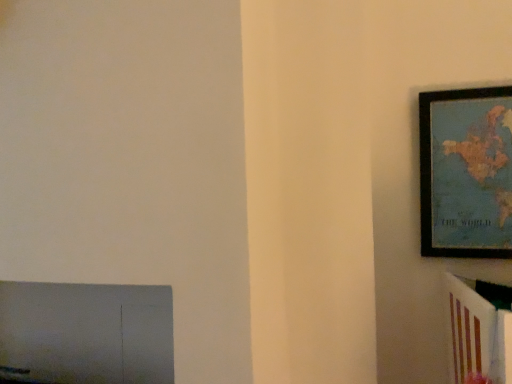
Where is `white glossy bookshelf at right`? white glossy bookshelf at right is located at coordinates (478, 330).

What do you see at coordinates (478, 330) in the screenshot? I see `white glossy bookshelf at right` at bounding box center [478, 330].

Measure the distance between white glossy bookshelf at right and camera.

white glossy bookshelf at right is 34.86 inches away from camera.

Find the location of a particular element. The width and height of the screenshot is (512, 384). wooden framed map at upper right is located at coordinates (466, 173).

The height and width of the screenshot is (384, 512). What do you see at coordinates (466, 173) in the screenshot? I see `wooden framed map at upper right` at bounding box center [466, 173].

Where is `white glossy bookshelf at right`? white glossy bookshelf at right is located at coordinates (478, 330).

Based on their positions, is wooden framed map at upper right located to the left or right of white glossy bookshelf at right?

Based on their positions, wooden framed map at upper right is located to the right of white glossy bookshelf at right.

From the picture: Considering their positions, is wooden framed map at upper right located in front of or behind white glossy bookshelf at right?

Clearly, wooden framed map at upper right is behind white glossy bookshelf at right.

Is point (497, 174) less distant than point (490, 373)?

No, it is behind (490, 373).

From the image's perspective, is wooden framed map at upper right under white glossy bookshelf at right?

No, from the image's perspective, wooden framed map at upper right is not beneath white glossy bookshelf at right.

From a real-world perspective, does wooden framed map at upper right sit lower than white glossy bookshelf at right?

Actually, wooden framed map at upper right is physically above white glossy bookshelf at right in the real world.

Is wooden framed map at upper right wider or thinner than white glossy bookshelf at right?

In the image, wooden framed map at upper right appears to be more narrow than white glossy bookshelf at right.

Can you confirm if wooden framed map at upper right is shorter than white glossy bookshelf at right?

No, wooden framed map at upper right is not shorter than white glossy bookshelf at right.

Is wooden framed map at upper right smaller than white glossy bookshelf at right?

Incorrect, wooden framed map at upper right is not smaller in size than white glossy bookshelf at right.

Is wooden framed map at upper right not inside white glossy bookshelf at right?

Absolutely, wooden framed map at upper right is external to white glossy bookshelf at right.

Is wooden framed map at upper right directly adjacent to white glossy bookshelf at right?

No, wooden framed map at upper right is not making contact with white glossy bookshelf at right.

Does wooden framed map at upper right turn towards white glossy bookshelf at right?

Yes, wooden framed map at upper right is facing white glossy bookshelf at right.

What's the angular difference between wooden framed map at upper right and white glossy bookshelf at right's facing directions?

0.000992 degrees.

In order to click on picture frame above the white glossy bookshelf at right (from the image's perspective) in this screenshot , I will do `click(466, 173)`.

Is white glossy bookshelf at right to the left of wooden framed map at upper right from the viewer's perspective?

Indeed, white glossy bookshelf at right is positioned on the left side of wooden framed map at upper right.

Is white glossy bookshelf at right in front of or behind wooden framed map at upper right in the image?

white glossy bookshelf at right is in front of wooden framed map at upper right.

Is point (483, 326) behind point (504, 175)?

No, (483, 326) is in front of (504, 175).

From the image's perspective, is white glossy bookshelf at right positioned above or below wooden framed map at upper right?

white glossy bookshelf at right is below wooden framed map at upper right.

From a real-world perspective, who is located higher, white glossy bookshelf at right or wooden framed map at upper right?

In real-world perspective, wooden framed map at upper right is above.

Considering the relative sizes of white glossy bookshelf at right and wooden framed map at upper right in the image provided, is white glossy bookshelf at right wider than wooden framed map at upper right?

Yes.

Considering the relative sizes of white glossy bookshelf at right and wooden framed map at upper right in the image provided, is white glossy bookshelf at right taller than wooden framed map at upper right?

Incorrect, the height of white glossy bookshelf at right is not larger of that of wooden framed map at upper right.

Can you confirm if white glossy bookshelf at right is bigger than wooden framed map at upper right?

No, white glossy bookshelf at right is not bigger than wooden framed map at upper right.

Is white glossy bookshelf at right not within wooden framed map at upper right?

Indeed, white glossy bookshelf at right is completely outside wooden framed map at upper right.

Does white glossy bookshelf at right touch wooden framed map at upper right?

No, white glossy bookshelf at right is not beside wooden framed map at upper right.

Is wooden framed map at upper right at the back of white glossy bookshelf at right?

No, white glossy bookshelf at right's orientation is not away from wooden framed map at upper right.

Find the location of a particular element. The image size is (512, 384). furniture below the wooden framed map at upper right (from a real-world perspective) is located at coordinates (478, 330).

Identify the location of picture frame above the white glossy bookshelf at right (from the image's perspective). This screenshot has height=384, width=512. (466, 173).

This screenshot has width=512, height=384. What are the coordinates of `furniture on the left side of wooden framed map at upper right` in the screenshot? It's located at (478, 330).